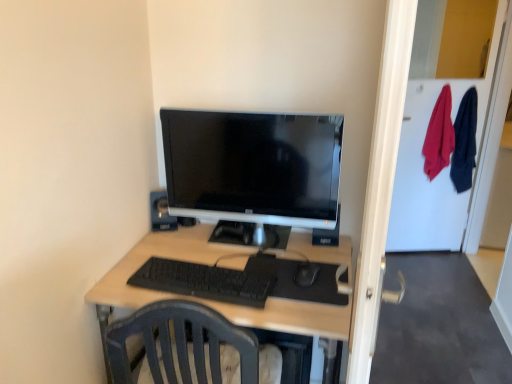
This screenshot has height=384, width=512. Identify the location of vacant space behind black matte keyboard at center. (214, 252).